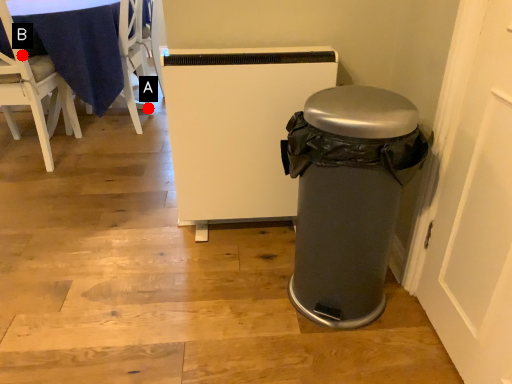
Question: Two points are circled on the image, labeled by A and B beside each circle. Which point is closer to the camera?

Choices:
 (A) A is closer
 (B) B is closer

Answer: (B)